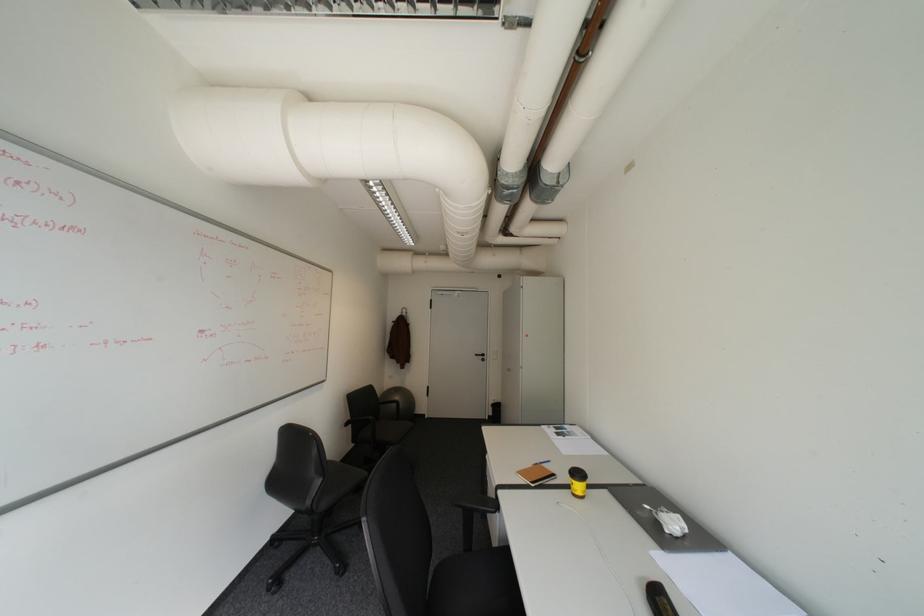
Describe the element at coordinates (397, 403) in the screenshot. This screenshot has width=924, height=616. I see `the grey exercise ball` at that location.